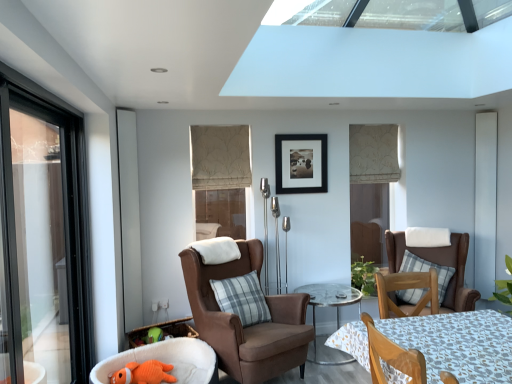
Question: Would you say orange plush toy at lower left is part of gray plaid pillow at center, which ranks as the 2th pillow in back-to-front order,'s contents?

Choices:
 (A) yes
 (B) no

Answer: (B)

Question: Is gray plaid pillow at center, the 1th pillow when ordered from front to back, turned away from orange plush toy at lower left?

Choices:
 (A) no
 (B) yes

Answer: (A)

Question: Considering the relative sizes of gray plaid pillow at center, arranged as the 1th pillow when viewed from the left, and orange plush toy at lower left in the image provided, is gray plaid pillow at center, arranged as the 1th pillow when viewed from the left, shorter than orange plush toy at lower left?

Choices:
 (A) yes
 (B) no

Answer: (B)

Question: Does gray plaid pillow at center, the 1th pillow when ordered from front to back, have a greater height compared to orange plush toy at lower left?

Choices:
 (A) yes
 (B) no

Answer: (A)

Question: From the image's perspective, is gray plaid pillow at center, marked as the second pillow in a right-to-left arrangement, located above orange plush toy at lower left?

Choices:
 (A) yes
 (B) no

Answer: (A)

Question: Is clear glass table at center taller or shorter than beige fabric curtain at upper center?

Choices:
 (A) tall
 (B) short

Answer: (B)

Question: From the image's perspective, relative to beige fabric curtain at upper center, is clear glass table at center above or below?

Choices:
 (A) below
 (B) above

Answer: (A)

Question: From a real-world perspective, relative to beige fabric curtain at upper center, is clear glass table at center vertically above or below?

Choices:
 (A) above
 (B) below

Answer: (B)

Question: Considering the positions of clear glass table at center and beige fabric curtain at upper center in the image, is clear glass table at center wider or thinner than beige fabric curtain at upper center?

Choices:
 (A) thin
 (B) wide

Answer: (B)

Question: Does point (236, 226) appear closer or farther from the camera than point (345, 296)?

Choices:
 (A) farther
 (B) closer

Answer: (A)

Question: Which is correct: matte beige blind at center, which is counted as the first window, starting from the bottom, is inside clear glass table at center, or outside of it?

Choices:
 (A) outside
 (B) inside

Answer: (A)

Question: From a real-world perspective, is matte beige blind at center, the 2th window from the top, above or below clear glass table at center?

Choices:
 (A) above
 (B) below

Answer: (A)

Question: In terms of size, does matte beige blind at center, the 2th window from the top, appear bigger or smaller than clear glass table at center?

Choices:
 (A) small
 (B) big

Answer: (A)

Question: Do you think suede brown armchair at center, arranged as the second chair when viewed from the left, is within wooden chair at lower right, which is the second chair from right to left, or outside of it?

Choices:
 (A) outside
 (B) inside

Answer: (A)

Question: In terms of width, does suede brown armchair at center, arranged as the second chair when viewed from the left, look wider or thinner when compared to wooden chair at lower right, which is the second chair from right to left?

Choices:
 (A) wide
 (B) thin

Answer: (A)